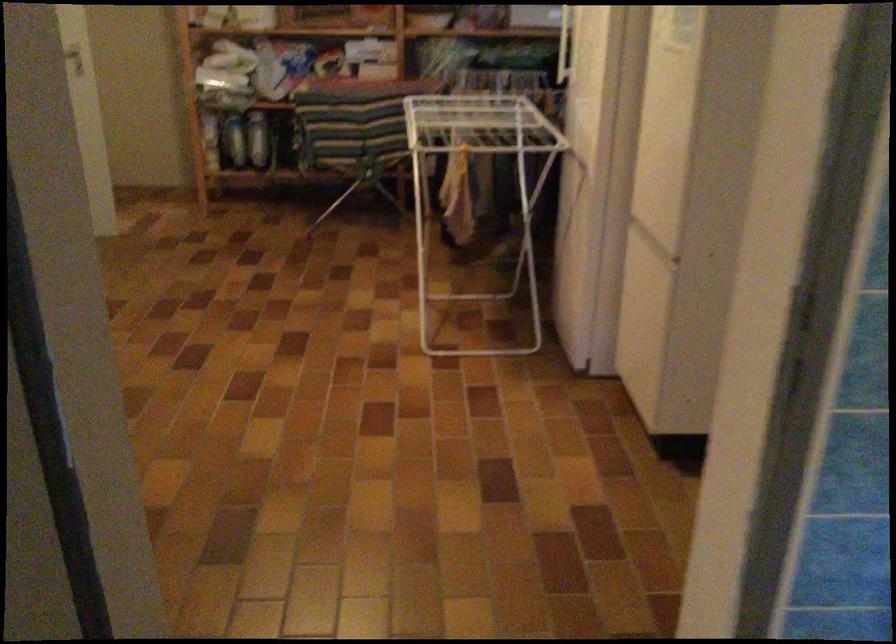
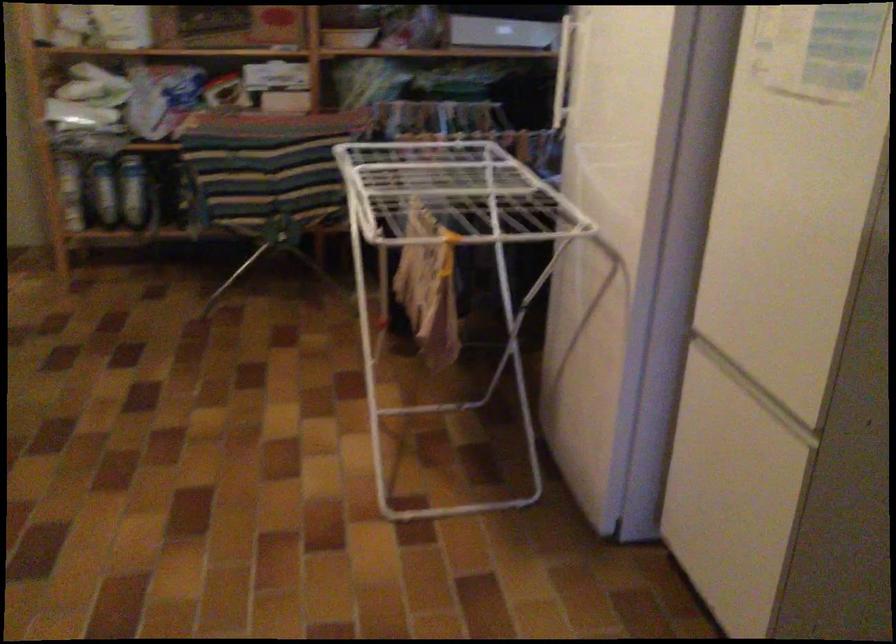
Question: I am providing you with two images of the same scene from different viewpoints. After the viewpoint changes to image2, which objects are now occluded?

Choices:
 (A) white drying rack
 (B) freezer door handle
 (C) blue bottle
 (D) none of these

Answer: (D)